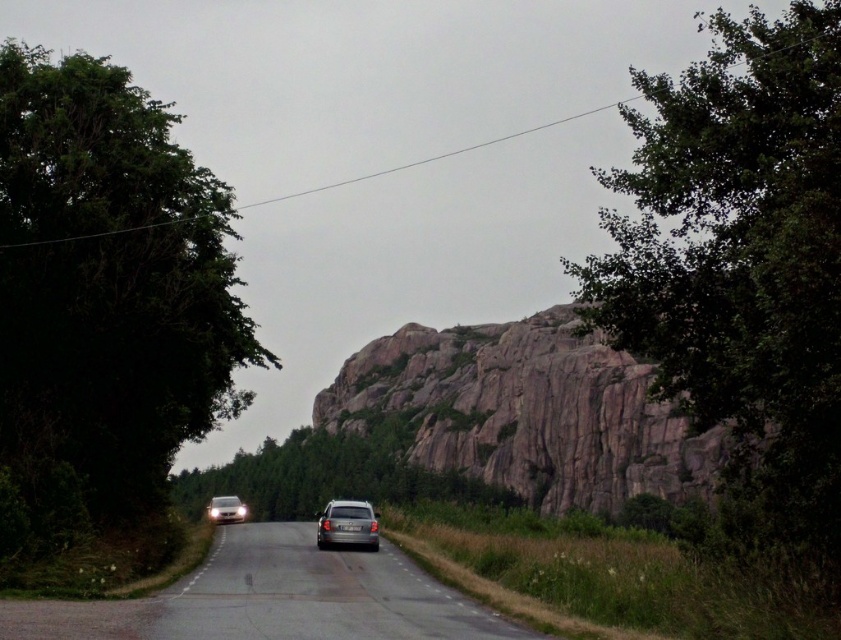
Can you confirm if rusty granite mountain at center is positioned above silver metallic car at center?

Indeed, rusty granite mountain at center is positioned over silver metallic car at center.

Does rusty granite mountain at center come behind silver metallic car at center?

Yes, it is behind silver metallic car at center.

What do you see at coordinates (527, 412) in the screenshot? Image resolution: width=841 pixels, height=640 pixels. I see `rusty granite mountain at center` at bounding box center [527, 412].

Locate an element on the screen. The image size is (841, 640). rusty granite mountain at center is located at coordinates (527, 412).

At what (x,y) coordinates should I click in order to perform the action: click on green leafy tree at left. Please return your answer as a coordinate pair (x, y). Looking at the image, I should click on (104, 298).

Looking at this image, is green leafy tree at left positioned before white matte car at lower left?

Yes, green leafy tree at left is closer to the viewer.

The image size is (841, 640). I want to click on green leafy tree at left, so click(104, 298).

The width and height of the screenshot is (841, 640). I want to click on green leafy tree at left, so point(104,298).

Does green leafy tree at upper right have a larger size compared to green leafy tree at center?

Correct, green leafy tree at upper right is larger in size than green leafy tree at center.

Can you confirm if green leafy tree at upper right is shorter than green leafy tree at center?

No.

This screenshot has height=640, width=841. Identify the location of green leafy tree at upper right. (742, 273).

The image size is (841, 640). What are the coordinates of `green leafy tree at upper right` in the screenshot? It's located at (742, 273).